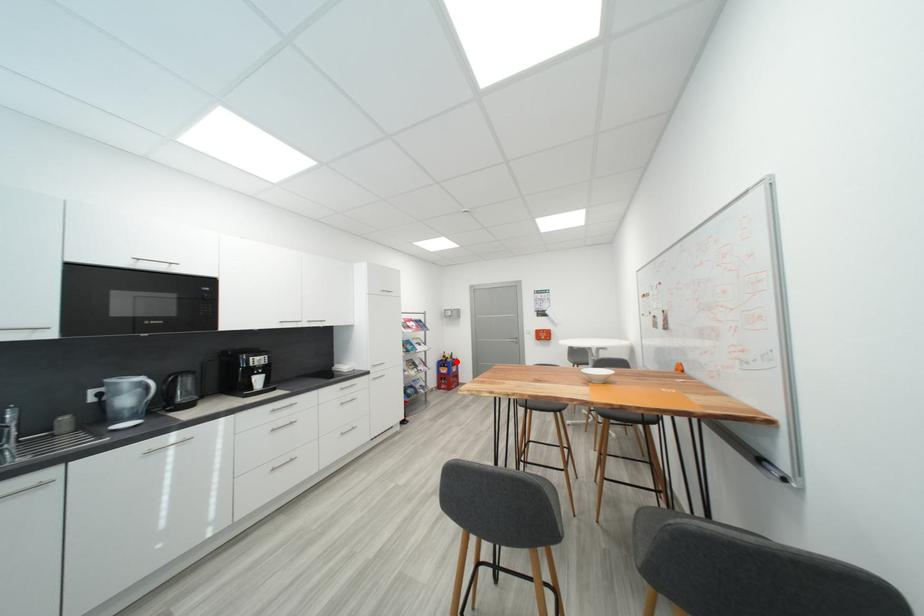
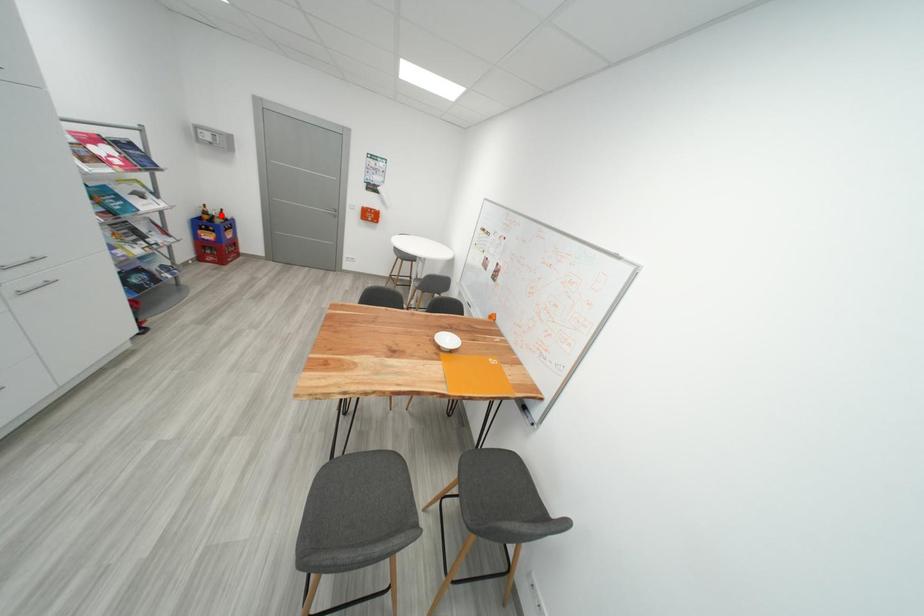
I am providing you with two images of the same scene from different viewpoints. A red point is marked on the first image and another point is marked on the second image. Are the points marked in image1 and image2 representing the same 3D position?

No